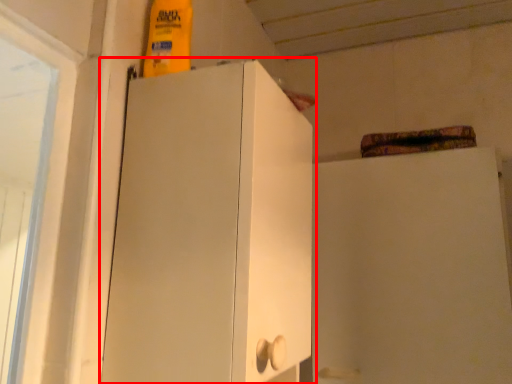
Question: From the image's perspective, where is cupboard (annotated by the red box) located in relation to cabinetry in the image?

Choices:
 (A) below
 (B) above

Answer: (B)